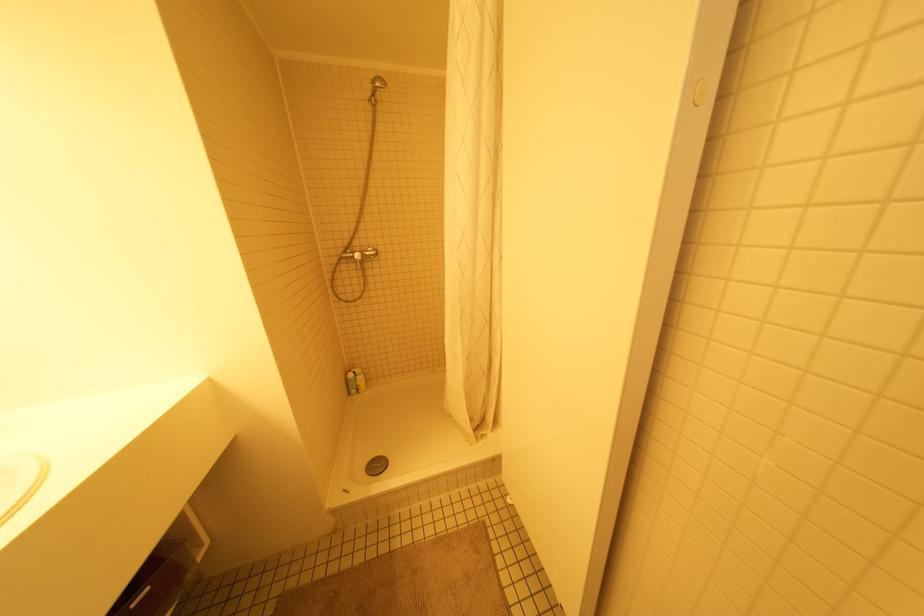
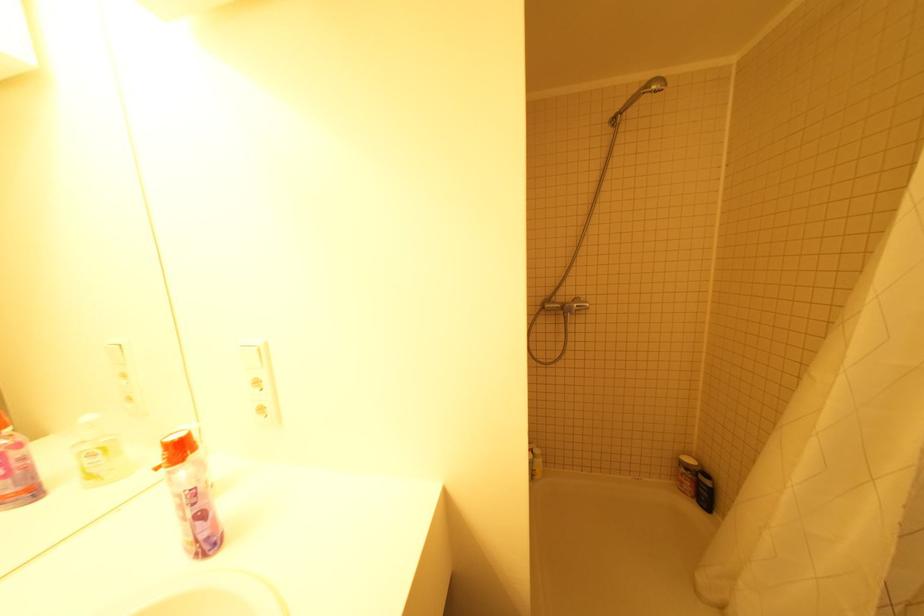
Find the pixel in the second image that matches (x=372, y=81) in the first image.

(649, 84)